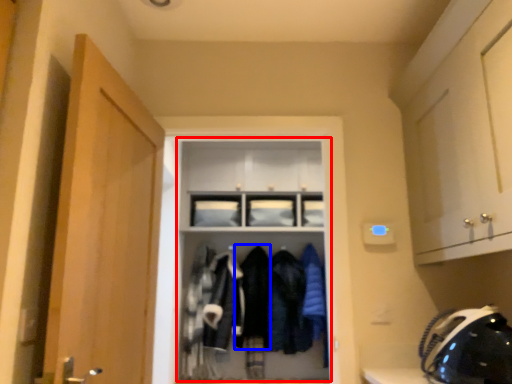
Question: Which point is further to the camera, dresser (highlighted by a red box) or clothing (highlighted by a blue box)?

Choices:
 (A) dresser
 (B) clothing

Answer: (B)